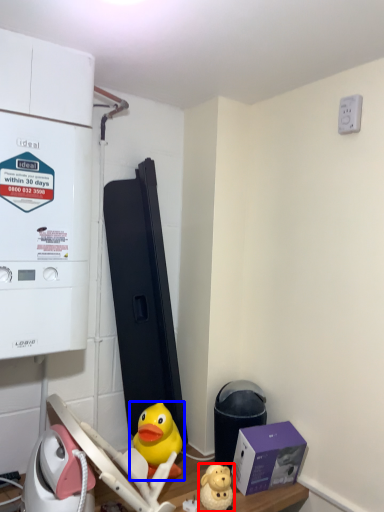
Question: Which object is closer to the camera taking this photo, toy (highlighted by a red box) or toy (highlighted by a blue box)?

Choices:
 (A) toy
 (B) toy

Answer: (A)